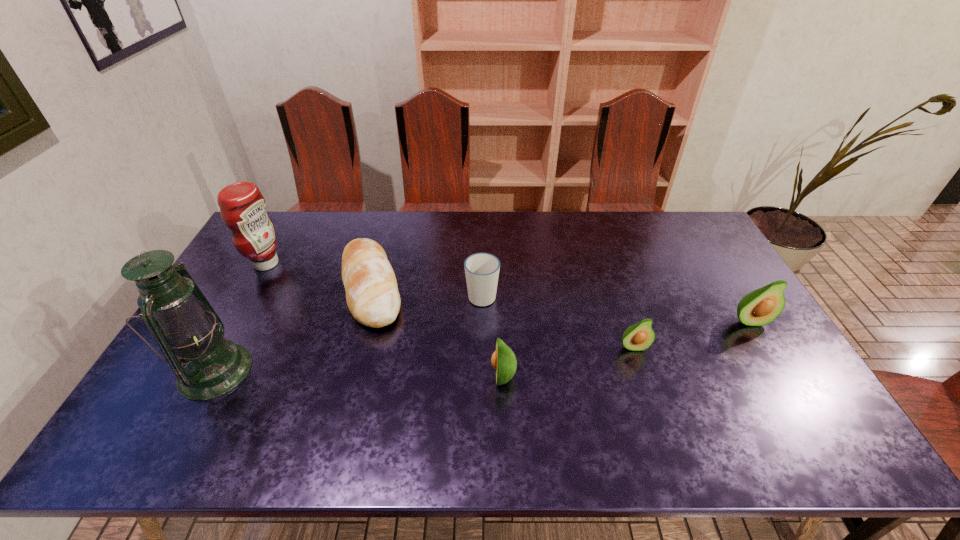
What are the coordinates of `free space located 0.180m on the cut side of the second tallest avocado` in the screenshot? It's located at (421, 376).

This screenshot has width=960, height=540. I want to click on vacant space located on the cut side of the second tallest avocado, so click(x=464, y=376).

This screenshot has width=960, height=540. Identify the location of free location located 0.050m on the cut side of the second tallest avocado. (471, 376).

This screenshot has height=540, width=960. In order to click on free space located on the cut side of the rightmost object in this screenshot , I will do `click(785, 381)`.

Locate an element on the screen. vacant space positioned 0.100m with a handle on the side of the cup is located at coordinates (482, 262).

The width and height of the screenshot is (960, 540). In order to click on free location located 0.090m with a handle on the side of the cup in this screenshot , I will do `click(482, 264)`.

You are a GUI agent. You are given a task and a screenshot of the screen. Output one action in this format:
    pyautogui.click(x=<x>, y=<y>)
    Task: Click on the free space located with a handle on the side of the cup
    The image size is (960, 540).
    Given the screenshot: What is the action you would take?
    click(x=482, y=220)

Locate an element on the screen. The height and width of the screenshot is (540, 960). vacant space situated on the front of the second tallest object is located at coordinates (207, 368).

Image resolution: width=960 pixels, height=540 pixels. What are the coordinates of `free point located on the back of the tallest object` in the screenshot? It's located at (267, 275).

Where is `free space located on the left of the bread`? free space located on the left of the bread is located at coordinates (232, 288).